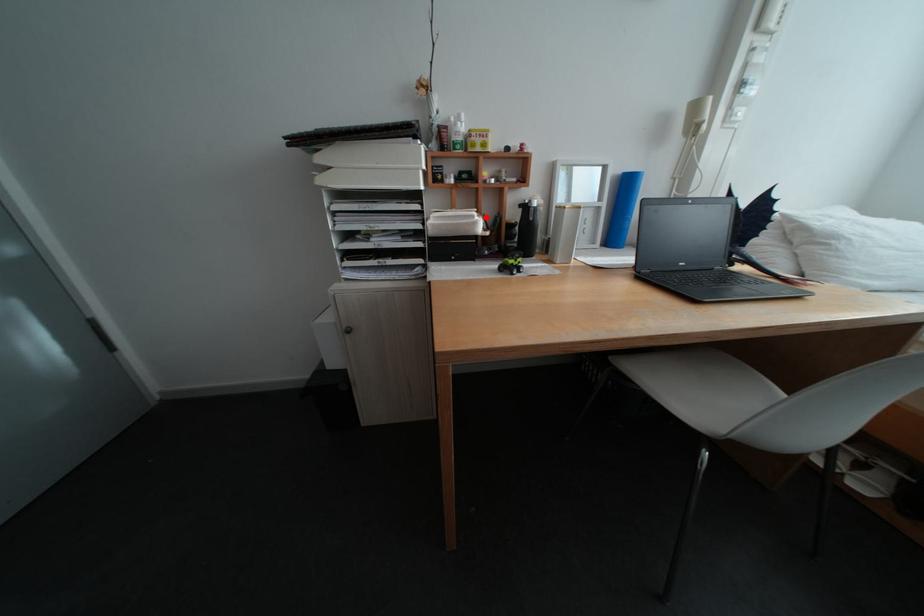
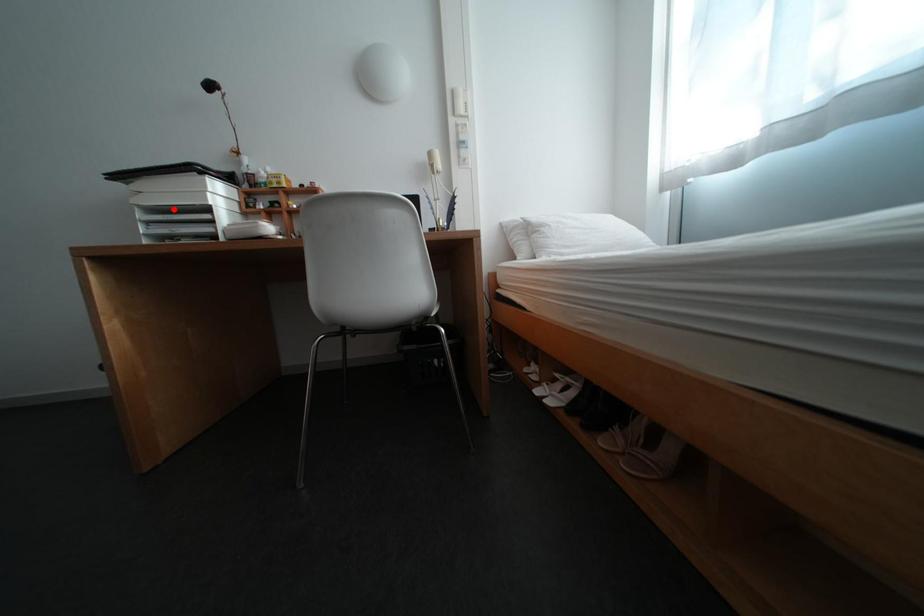
I am providing you with two images of the same scene from different viewpoints. A red point is marked on the first image and another point is marked on the second image. Do the highlighted points in image1 and image2 indicate the same real-world spot?

No